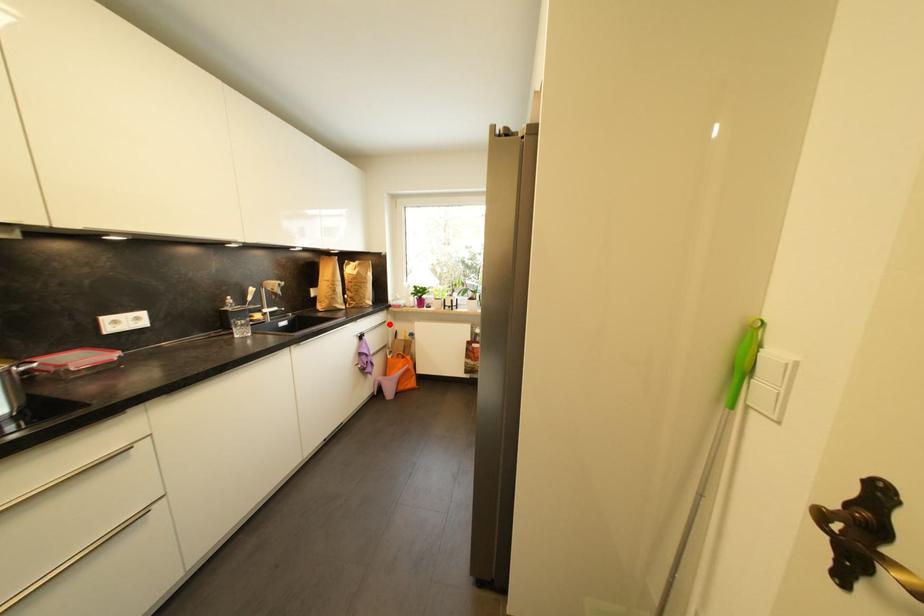
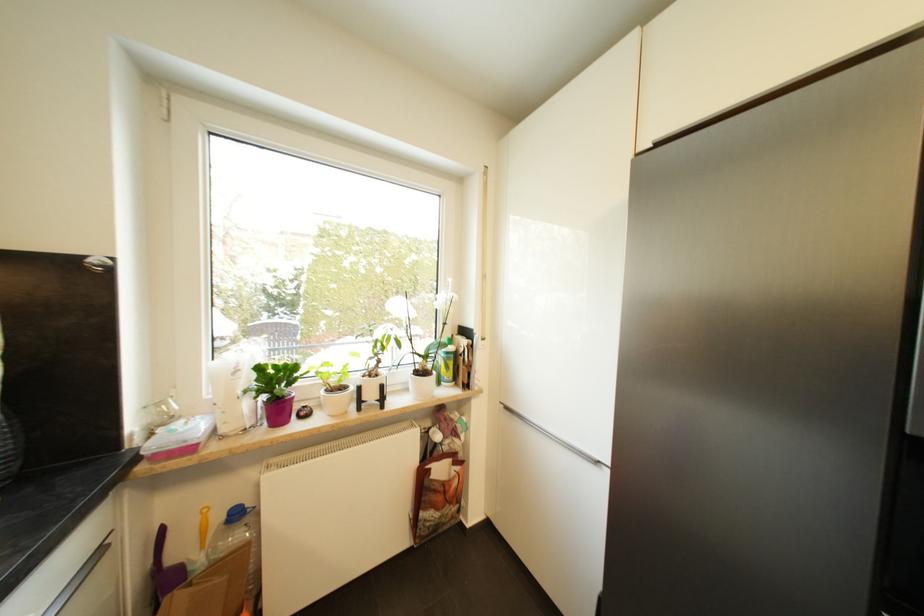
In the second image, find the point that corresponds to the highlighted location in the first image.

(105, 553)